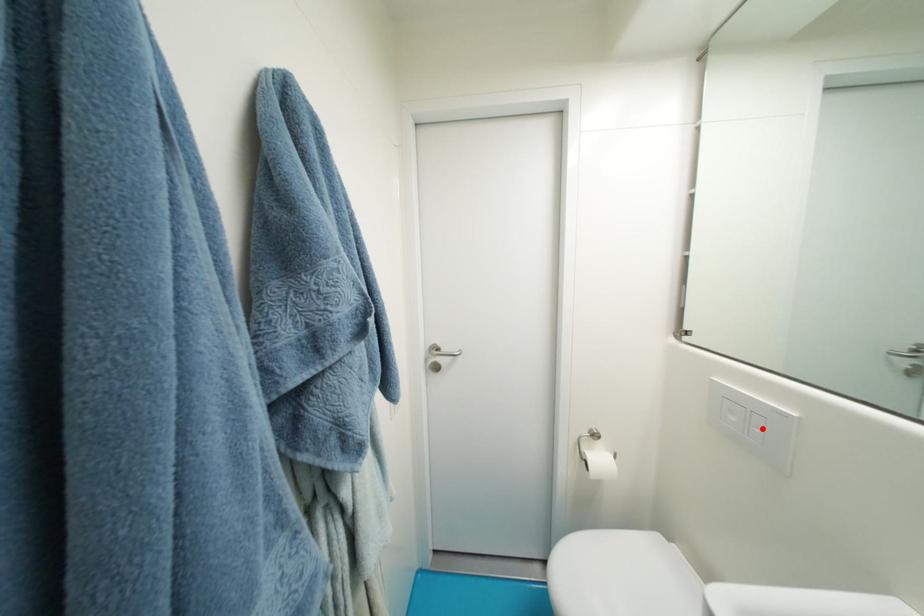
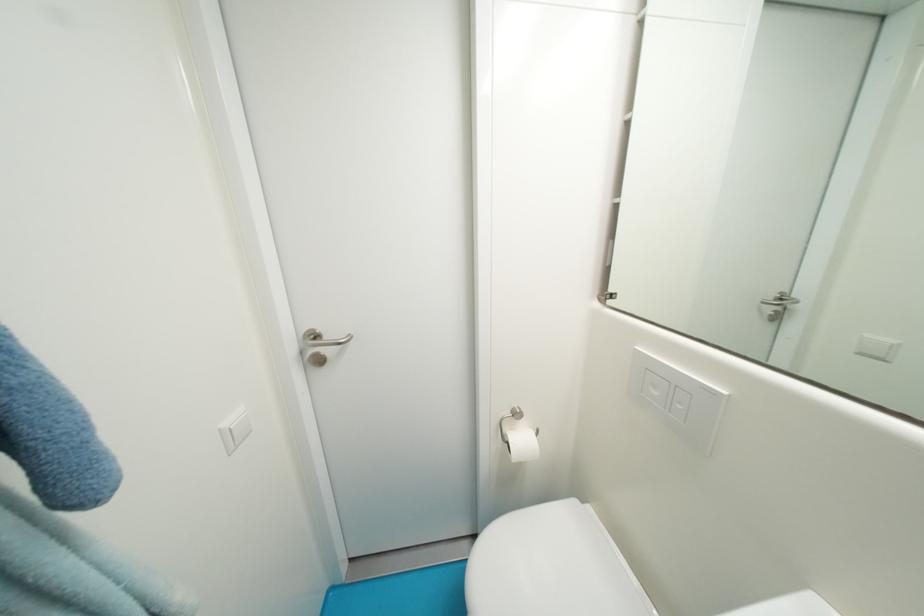
Find the pixel in the second image that matches the highlighted location in the first image.

(687, 406)